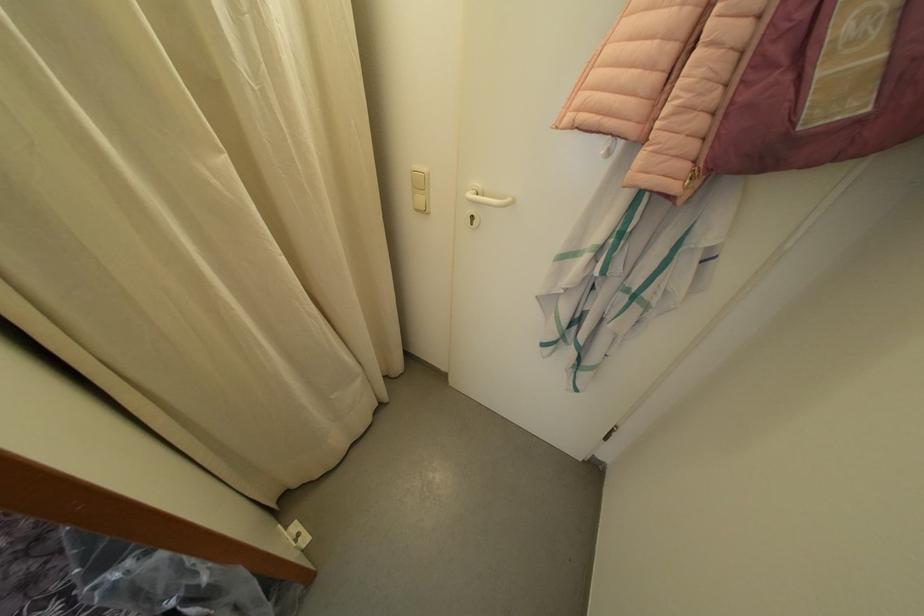
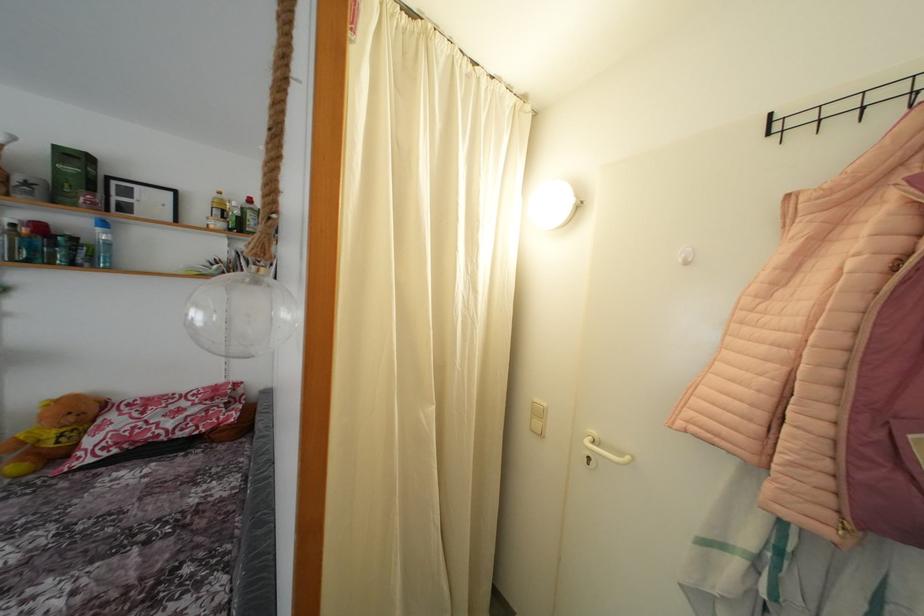
Locate, in the second image, the point that corresponds to point 477,223 in the first image.

(593, 464)